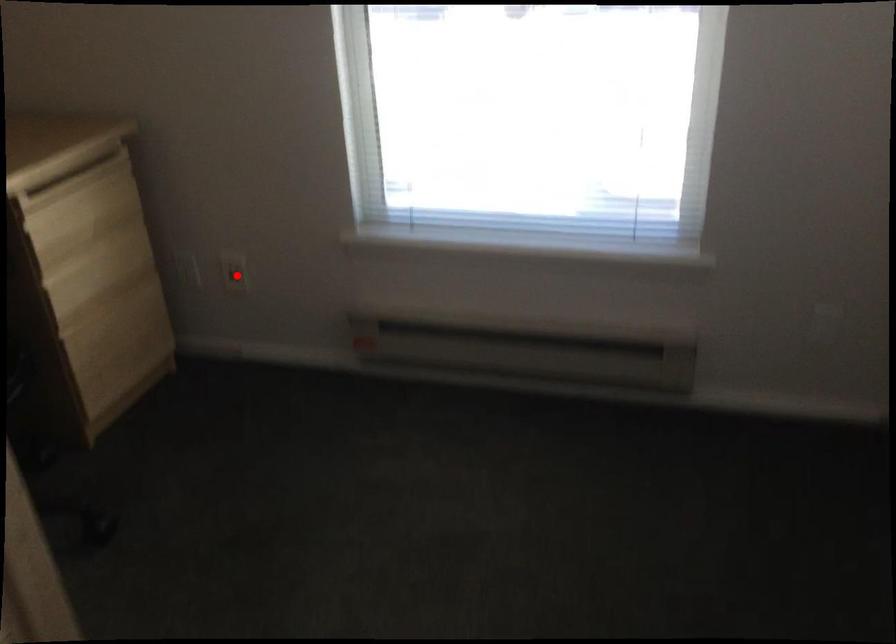
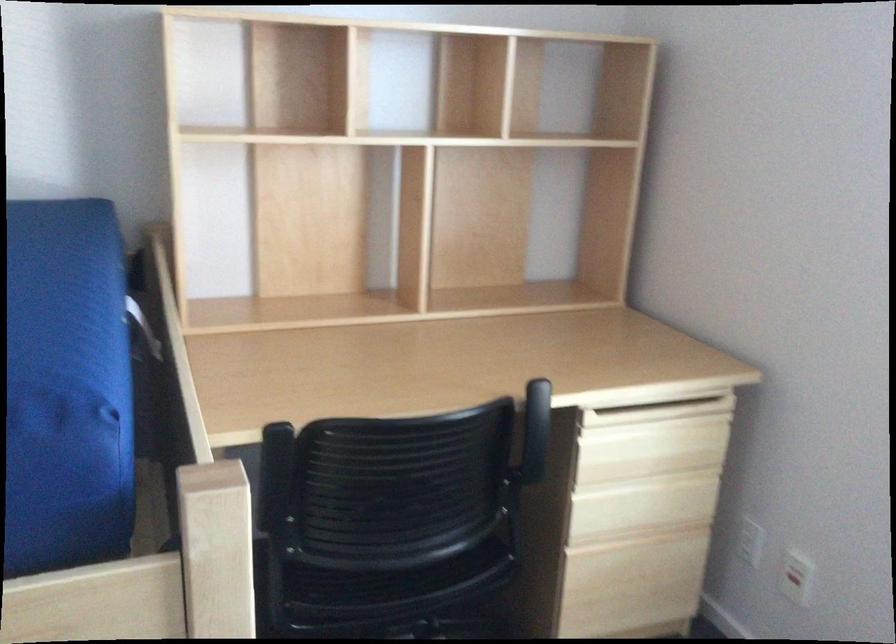
Question: I am providing you with two images of the same scene from different viewpoints. A red point is shown in image1. For the corresponding object point in image2, is it positioned nearer or farther from the camera?

Choices:
 (A) Nearer
 (B) Farther

Answer: (A)